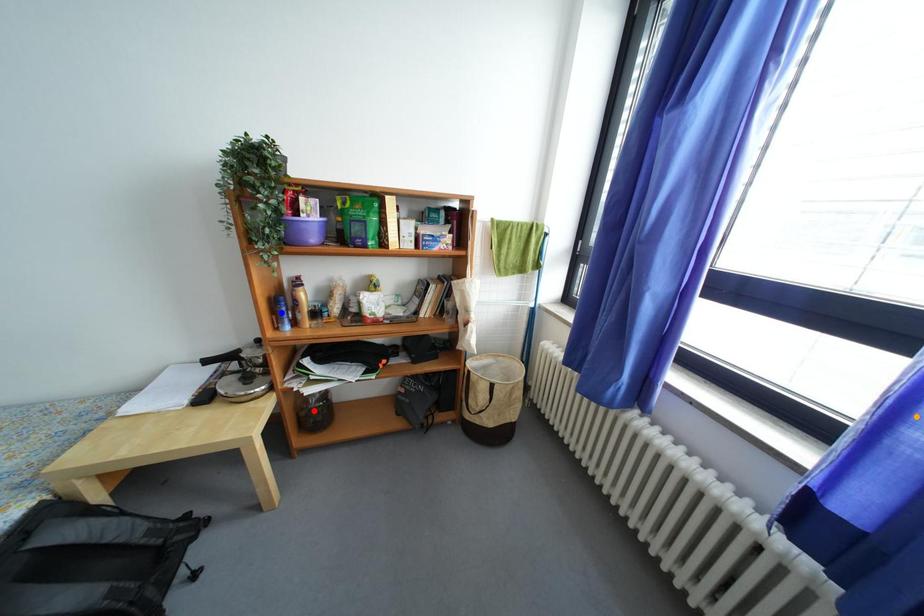
Order these from nearest to farthest:
1. red point
2. blue point
3. orange point

orange point
blue point
red point